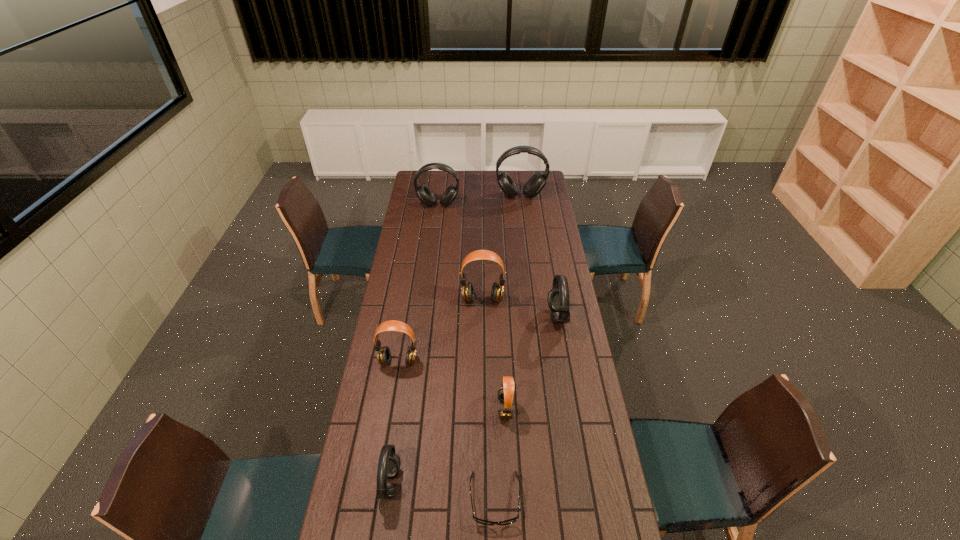
Where is `headset that is the fourth closest to the smallest brown headset`? This screenshot has width=960, height=540. headset that is the fourth closest to the smallest brown headset is located at coordinates [497, 291].

This screenshot has width=960, height=540. What are the coordinates of `headset that is the fifth closest to the nearest headset` in the screenshot? It's located at (426, 196).

Find the location of `the closest gray headset to the smallest brown headset`. the closest gray headset to the smallest brown headset is located at coordinates (558, 297).

I want to click on gray headset that stands as the second closest to the smallest gray headset, so click(x=426, y=196).

Find the location of a particular element. brown headset that stands as the closest to the third smallest gray headset is located at coordinates (497, 291).

Where is `brown headset that is the third closest to the second nearest gray headset`? The image size is (960, 540). brown headset that is the third closest to the second nearest gray headset is located at coordinates (383, 353).

Identify the location of free location that satisfies the following two spatial constraints: 1. on the earcups of the tallest object; 2. on the earcups of the nearest headset. The height and width of the screenshot is (540, 960). (556, 483).

Locate an element on the screen. free region that satisfies the following two spatial constraints: 1. on the earcups of the third biggest gray headset; 2. on the ear cups of the fourth nearest object is located at coordinates [565, 361].